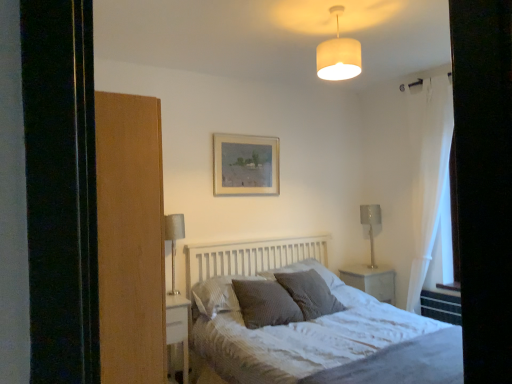
Question: Can we say white glossy nightstand at center, the second nightstand positioned from the left, lies outside textured gray pillow at center, which is counted as the third pillow, starting from the left?

Choices:
 (A) no
 (B) yes

Answer: (B)

Question: Is white glossy nightstand at center, the 1th nightstand positioned from the right, behind textured gray pillow at center, which is counted as the third pillow, starting from the left?

Choices:
 (A) no
 (B) yes

Answer: (B)

Question: From a real-world perspective, is white glossy nightstand at center, the 2th nightstand positioned from the front, positioned under textured gray pillow at center, which is the 2th pillow in right-to-left order, based on gravity?

Choices:
 (A) yes
 (B) no

Answer: (A)

Question: From the image's perspective, would you say white glossy nightstand at center, the first nightstand viewed from the back, is shown under textured gray pillow at center, which is counted as the third pillow, starting from the left?

Choices:
 (A) no
 (B) yes

Answer: (B)

Question: Can you confirm if white glossy nightstand at center, the 1th nightstand positioned from the right, is positioned to the left of textured gray pillow at center, which is the 2th pillow in right-to-left order?

Choices:
 (A) yes
 (B) no

Answer: (B)

Question: Is wooden picture frame at upper center bigger or smaller than dark grey textured pillow at center, the first pillow from the left?

Choices:
 (A) big
 (B) small

Answer: (B)

Question: Is wooden picture frame at upper center taller or shorter than dark grey textured pillow at center, the fourth pillow from the right?

Choices:
 (A) tall
 (B) short

Answer: (A)

Question: Relative to dark grey textured pillow at center, the first pillow from the left, is wooden picture frame at upper center in front or behind?

Choices:
 (A) behind
 (B) front

Answer: (A)

Question: Is point (231, 182) closer or farther from the camera than point (199, 309)?

Choices:
 (A) farther
 (B) closer

Answer: (A)

Question: Is textured gray pillow at center, marked as the 2th pillow in a left-to-right arrangement, in front of or behind white glossy nightstand at lower left, placed as the first nightstand when sorted from front to back, in the image?

Choices:
 (A) behind
 (B) front

Answer: (A)

Question: Choose the correct answer: Is textured gray pillow at center, the third pillow positioned from the right, inside white glossy nightstand at lower left, which is the 2th nightstand from back to front, or outside it?

Choices:
 (A) inside
 (B) outside

Answer: (B)

Question: Looking at the image, does textured gray pillow at center, marked as the 2th pillow in a left-to-right arrangement, seem bigger or smaller compared to white glossy nightstand at lower left, placed as the first nightstand when sorted from front to back?

Choices:
 (A) big
 (B) small

Answer: (B)

Question: Is textured gray pillow at center, the third pillow positioned from the right, to the left or to the right of white glossy nightstand at lower left, placed as the first nightstand when sorted from front to back, in the image?

Choices:
 (A) left
 (B) right

Answer: (B)

Question: Is textured gray pillow at center, the third pillow positioned from the right, taller or shorter than metallic silver table lamp at right, acting as the 1th table lamp starting from the right?

Choices:
 (A) short
 (B) tall

Answer: (A)

Question: Does point (252, 307) appear closer or farther from the camera than point (362, 210)?

Choices:
 (A) farther
 (B) closer

Answer: (B)